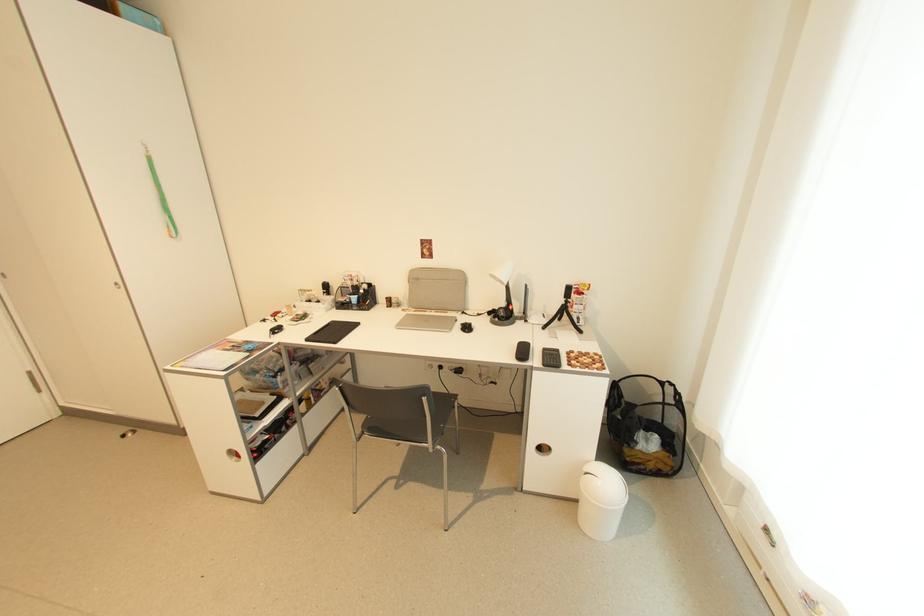
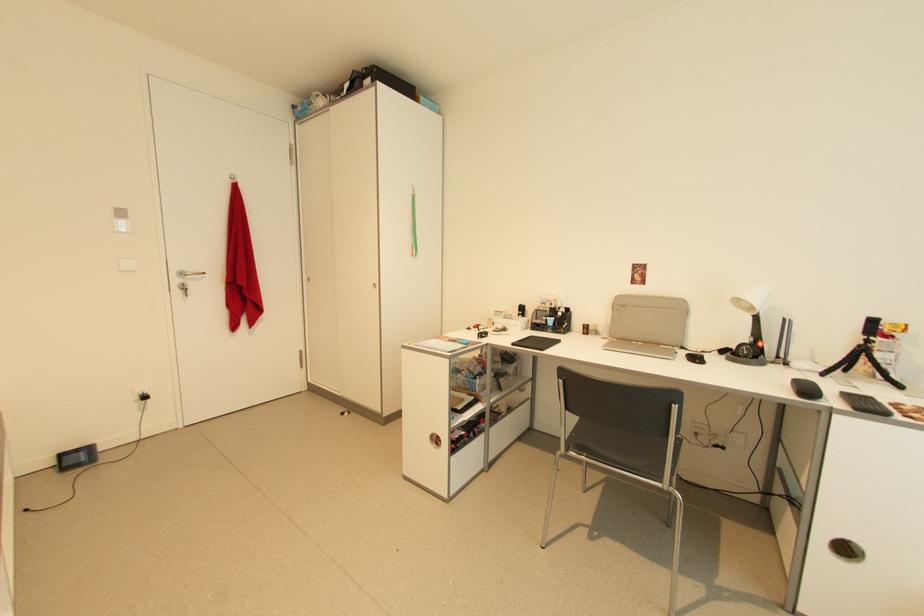
Question: How did the camera likely rotate?

Choices:
 (A) Left
 (B) Right
 (C) Up
 (D) Down

Answer: (A)